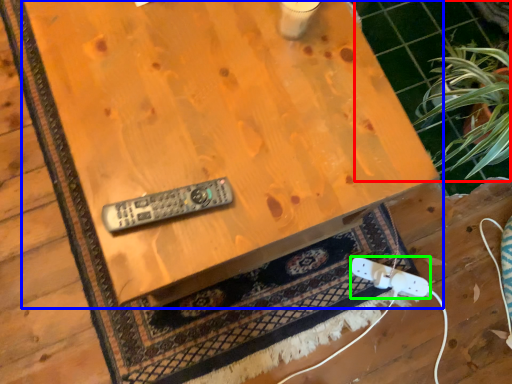
Question: Considering the real-world distances, which object is farthest from tile (highlighted by a red box)? table (highlighted by a blue box) or game controller (highlighted by a green box)?

Choices:
 (A) table
 (B) game controller

Answer: (A)